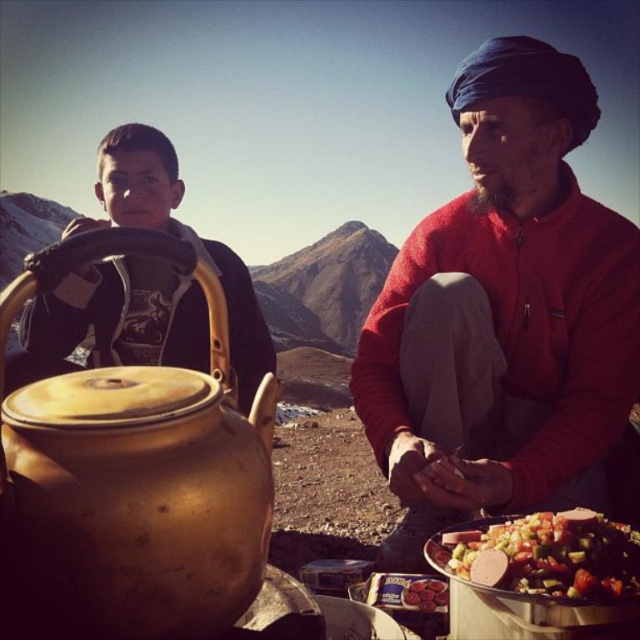
Question: Can you confirm if red wool sweater at center is positioned to the right of gold matte teapot at left?

Choices:
 (A) yes
 (B) no

Answer: (A)

Question: Is gold matte teapot at left behind matte black jacket at left?

Choices:
 (A) no
 (B) yes

Answer: (A)

Question: Among these objects, which one is farthest from the camera?

Choices:
 (A) matte black jacket at left
 (B) red wool sweater at center

Answer: (B)

Question: Which object is farther from the camera taking this photo?

Choices:
 (A) matte black jacket at left
 (B) red wool sweater at center
 (C) gold matte teapot at left
 (D) shiny metallic bowl at lower right

Answer: (B)

Question: In this image, where is red wool sweater at center located relative to gold matte teapot at left?

Choices:
 (A) above
 (B) below

Answer: (A)

Question: Which point appears closest to the camera in this image?

Choices:
 (A) (509, 147)
 (B) (168, 518)
 (C) (253, 392)

Answer: (B)